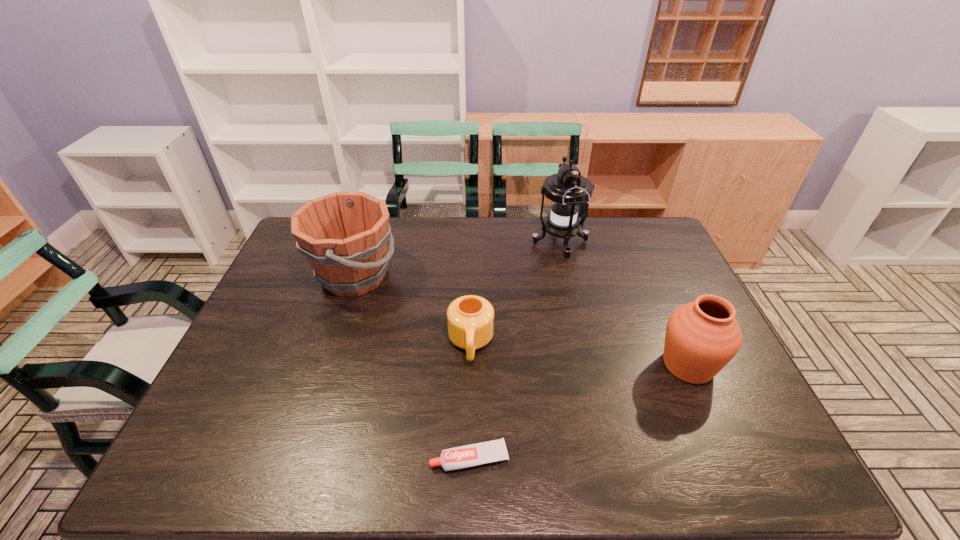
Where is `free space located on the handle side of the fourth tallest object`? The height and width of the screenshot is (540, 960). free space located on the handle side of the fourth tallest object is located at coordinates (468, 467).

This screenshot has width=960, height=540. What are the coordinates of `vacant space located 0.170m on the right of the toothpaste` in the screenshot? It's located at (587, 458).

Image resolution: width=960 pixels, height=540 pixels. Identify the location of lantern situated at the far edge. (567, 190).

The image size is (960, 540). In order to click on bucket at the far edge in this screenshot , I will do `click(344, 235)`.

Locate an element on the screen. The height and width of the screenshot is (540, 960). object present at the near edge is located at coordinates (471, 455).

You are a GUI agent. You are given a task and a screenshot of the screen. Output one action in this format:
    pyautogui.click(x=<x>, y=<y>)
    Task: Click on the object present at the left edge
    
    Given the screenshot: What is the action you would take?
    pyautogui.click(x=344, y=235)

Identify the location of object that is positioned at the right edge. click(702, 337).

Locate an element on the screen. The image size is (960, 540). object that is at the far left corner is located at coordinates (344, 235).

Find the location of a particular element. free space at the far edge of the desktop is located at coordinates (514, 235).

Find the location of `free spot at the near edge of the desktop`. free spot at the near edge of the desktop is located at coordinates (520, 465).